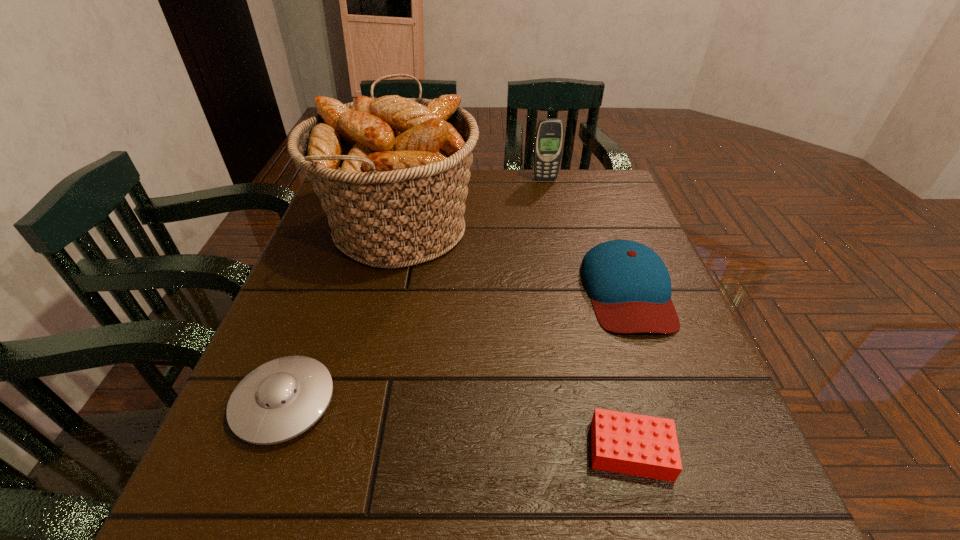
I want to click on free spot between the cellular telephone and the second shortest object, so click(x=415, y=291).

You are a GUI agent. You are given a task and a screenshot of the screen. Output one action in this format:
    pyautogui.click(x=<x>, y=<y>)
    Task: Click on the vacant area that lies between the farthest object and the shortest object
    The image size is (960, 540).
    Given the screenshot: What is the action you would take?
    pyautogui.click(x=588, y=315)

Image resolution: width=960 pixels, height=540 pixels. What are the coordinates of `free space between the baseball cap and the Lego` in the screenshot? It's located at (x=629, y=370).

You are a GUI agent. You are given a task and a screenshot of the screen. Output one action in this format:
    pyautogui.click(x=<x>, y=<y>)
    Task: Click on the free space between the third shortest object and the shortest object
    
    Given the screenshot: What is the action you would take?
    pyautogui.click(x=629, y=370)

Where is `the second closest object to the second shortest object`? the second closest object to the second shortest object is located at coordinates (639, 445).

Locate an element on the screen. the second closest object to the second shortest object is located at coordinates (639, 445).